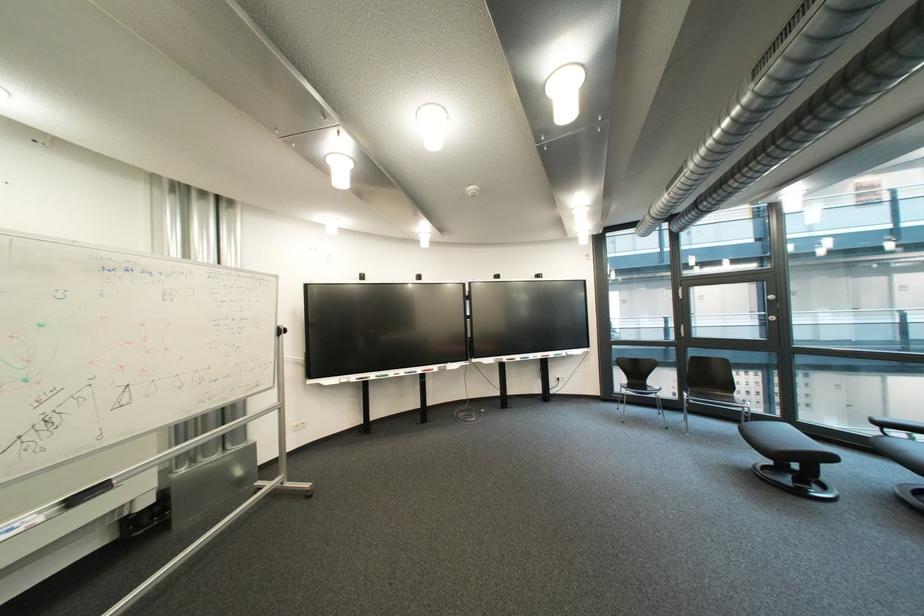
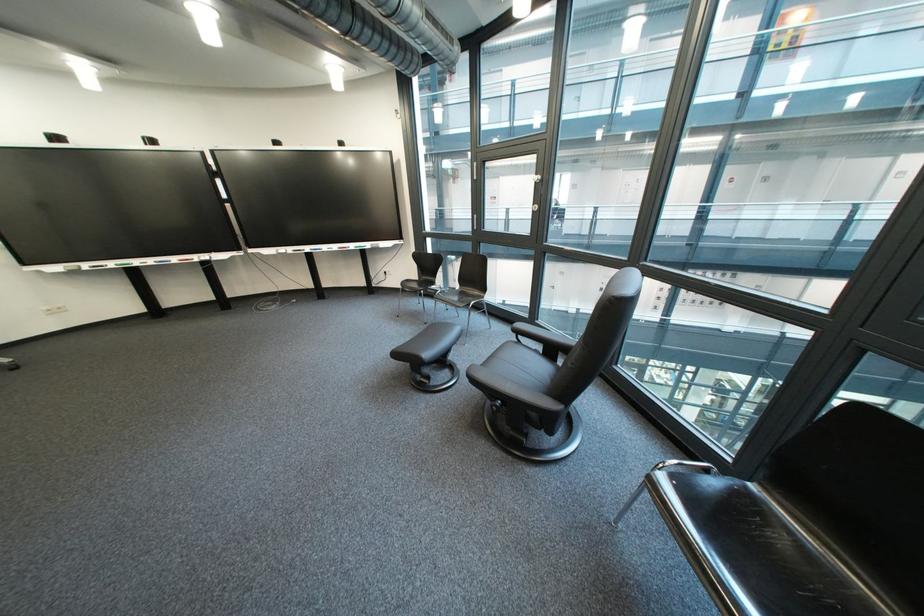
Find the pixel in the second image that matches pixel 681 430 in the first image.

(439, 325)